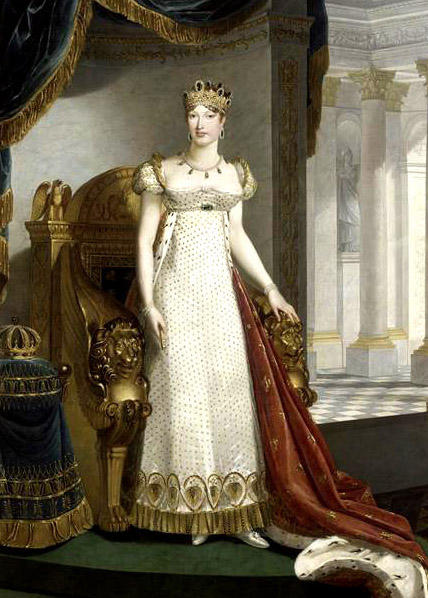
The width and height of the screenshot is (428, 598). What are the coordinates of `throne` in the screenshot? It's located at (76, 255).